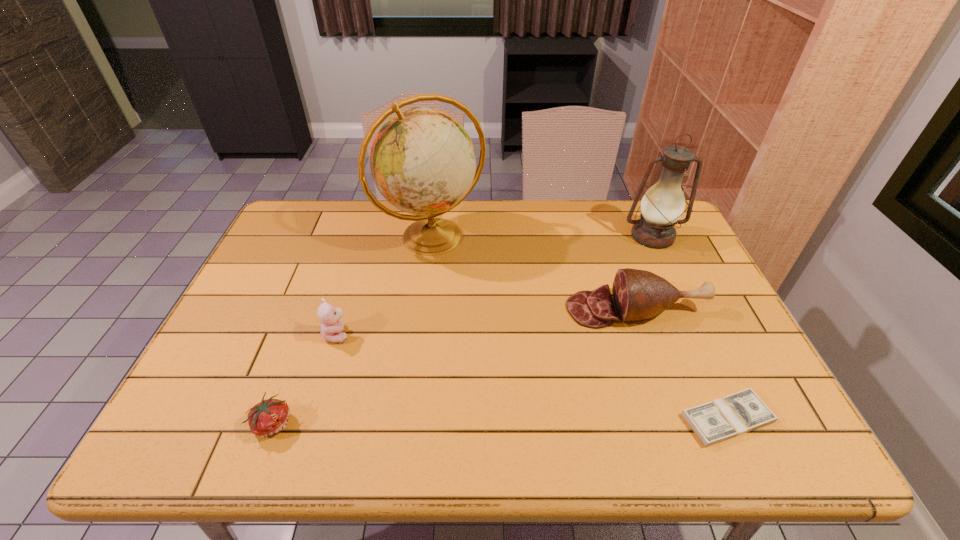
At what (x,y) coordinates should I click in order to perform the action: click on free spot located 0.260m at the sliced end of the ham. Please return your answer as a coordinate pair (x, y). Looking at the image, I should click on (470, 309).

This screenshot has width=960, height=540. In order to click on vacant region located at the sliced end of the ham in this screenshot , I will do `click(548, 309)`.

Find the location of a particular element. This screenshot has width=960, height=540. vacant space located 0.070m at the sliced end of the ham is located at coordinates (541, 309).

This screenshot has width=960, height=540. Find the location of `blank space located at the face of the teddy bear`. blank space located at the face of the teddy bear is located at coordinates (483, 334).

At what (x,y) coordinates should I click in order to perform the action: click on vacant space located 0.380m on the back of the leftmost object. Please return your answer as a coordinate pair (x, y). This screenshot has width=960, height=540. Looking at the image, I should click on (324, 286).

Locate an element on the screen. vacant space located 0.380m on the back of the dollar is located at coordinates (664, 279).

Identify the location of globe at the far edge. The height and width of the screenshot is (540, 960). (422, 160).

The width and height of the screenshot is (960, 540). In order to click on oil lamp that is at the far edge in this screenshot , I will do `click(663, 204)`.

Image resolution: width=960 pixels, height=540 pixels. Find the location of `tomato at the near edge`. tomato at the near edge is located at coordinates 267,418.

Locate an element on the screen. dollar that is at the near edge is located at coordinates (736, 414).